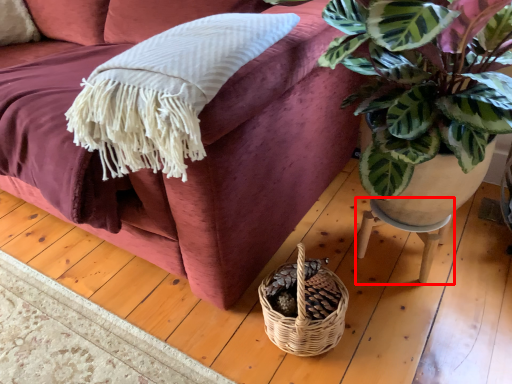
Question: From the image, what is the correct spatial relationship of table (annotated by the red box) in relation to studio couch?

Choices:
 (A) right
 (B) left

Answer: (A)